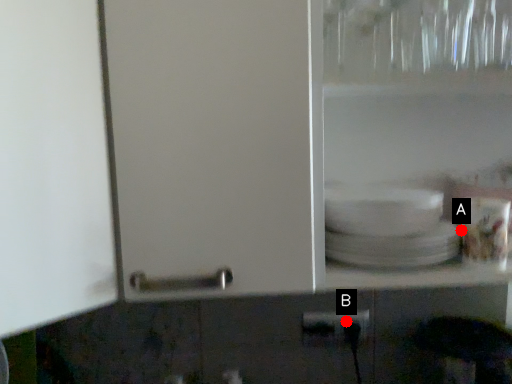
Question: Two points are circled on the image, labeled by A and B beside each circle. Which point is further to the camera?

Choices:
 (A) A is further
 (B) B is further

Answer: (B)